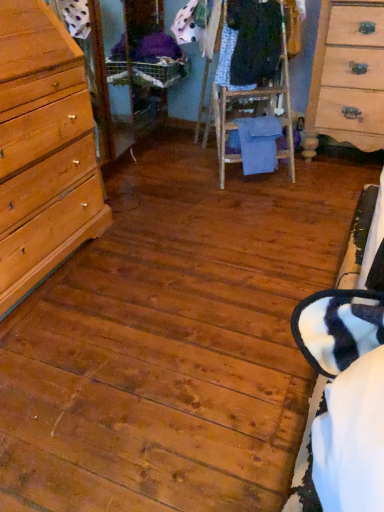
Question: Is blue cotton towel at center, marked as the third clothing in a top-to-bottom arrangement, not within dark blue fabric at center, the 1th clothing in the top-to-bottom sequence?

Choices:
 (A) yes
 (B) no

Answer: (A)

Question: Is blue cotton towel at center, marked as the third clothing in a top-to-bottom arrangement, smaller than dark blue fabric at center, which is counted as the 3th clothing, starting from the bottom?

Choices:
 (A) no
 (B) yes

Answer: (B)

Question: Is blue cotton towel at center, marked as the third clothing in a top-to-bottom arrangement, in contact with dark blue fabric at center, the 1th clothing in the top-to-bottom sequence?

Choices:
 (A) yes
 (B) no

Answer: (B)

Question: From a real-world perspective, is blue cotton towel at center, marked as the third clothing in a top-to-bottom arrangement, over dark blue fabric at center, the 1th clothing in the top-to-bottom sequence?

Choices:
 (A) yes
 (B) no

Answer: (B)

Question: Considering the relative sizes of blue cotton towel at center, marked as the third clothing in a top-to-bottom arrangement, and dark blue fabric at center, which is counted as the 3th clothing, starting from the bottom, in the image provided, is blue cotton towel at center, marked as the third clothing in a top-to-bottom arrangement, bigger than dark blue fabric at center, which is counted as the 3th clothing, starting from the bottom,?

Choices:
 (A) no
 (B) yes

Answer: (A)

Question: Does blue cotton towel at center, marked as the third clothing in a top-to-bottom arrangement, lie in front of dark blue fabric at center, which is counted as the 3th clothing, starting from the bottom?

Choices:
 (A) yes
 (B) no

Answer: (B)

Question: Is patterned fabric dress at center, the 2th clothing in the bottom-to-top sequence, further to camera compared to dark blue fabric at center, which is counted as the 3th clothing, starting from the bottom?

Choices:
 (A) yes
 (B) no

Answer: (A)

Question: Is patterned fabric dress at center, the 2th clothing in the bottom-to-top sequence, oriented towards dark blue fabric at center, which is counted as the 3th clothing, starting from the bottom?

Choices:
 (A) yes
 (B) no

Answer: (A)

Question: Is patterned fabric dress at center, marked as the 2th clothing in a top-to-bottom arrangement, outside of dark blue fabric at center, which is counted as the 3th clothing, starting from the bottom?

Choices:
 (A) yes
 (B) no

Answer: (B)

Question: Is the depth of patterned fabric dress at center, marked as the 2th clothing in a top-to-bottom arrangement, less than that of dark blue fabric at center, which is counted as the 3th clothing, starting from the bottom?

Choices:
 (A) yes
 (B) no

Answer: (B)

Question: Is patterned fabric dress at center, the 2th clothing in the bottom-to-top sequence, not close to dark blue fabric at center, the 1th clothing in the top-to-bottom sequence?

Choices:
 (A) no
 (B) yes

Answer: (A)

Question: Is dark blue fabric at center, which is counted as the 3th clothing, starting from the bottom, located within patterned fabric dress at center, the 2th clothing in the bottom-to-top sequence?

Choices:
 (A) yes
 (B) no

Answer: (B)

Question: Does patterned fabric dress at center, the 2th clothing in the bottom-to-top sequence, come behind light wood/finish dresser at right?

Choices:
 (A) no
 (B) yes

Answer: (B)